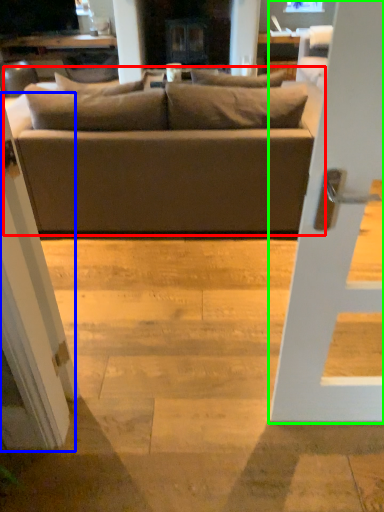
Question: Which object is the closest to the studio couch (highlighted by a red box)? Choose among these: screen door (highlighted by a blue box) or door (highlighted by a green box).

Choices:
 (A) screen door
 (B) door

Answer: (A)